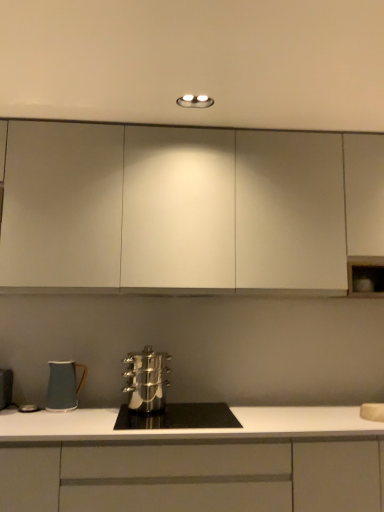
Image resolution: width=384 pixels, height=512 pixels. What are the coordinates of `free spot to the left of stainless steel steamer at center, the 2th kitchen appliance viewed from the left` in the screenshot? It's located at (95, 413).